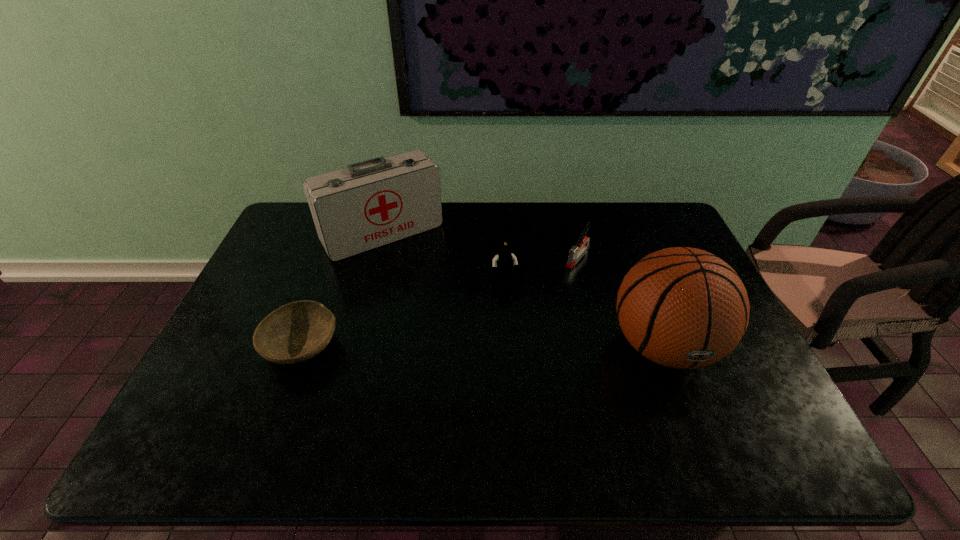
Locate an element on the screen. The image size is (960, 540). empty space between the first-aid kit and the basketball is located at coordinates (523, 289).

I want to click on free space between the stapler and the bowl, so click(441, 301).

Where is `vacant area that lies between the stapler and the first-aid kit`? Image resolution: width=960 pixels, height=540 pixels. vacant area that lies between the stapler and the first-aid kit is located at coordinates (481, 245).

Where is `vacant region between the fourth shortest object and the basketball`? Image resolution: width=960 pixels, height=540 pixels. vacant region between the fourth shortest object and the basketball is located at coordinates (523, 289).

I want to click on empty space that is in between the third tallest object and the basketball, so click(x=584, y=313).

The image size is (960, 540). In order to click on free point between the stapler and the bowl in this screenshot , I will do `click(441, 301)`.

Identify the location of unoccupied area between the bowl and the basketball. [x=483, y=346].

Image resolution: width=960 pixels, height=540 pixels. I want to click on free space between the basketball and the shortest object, so coord(483,346).

Select which object appears as the closest to the third shortest object. Please provide its 2D coordinates. Your answer should be formatted as a tuple, i.e. [(x, y)], where the tuple contains the x and y coordinates of a point satisfying the conditions above.

[(575, 252)]

Locate an element on the screen. object that stands as the second closest to the bowl is located at coordinates (503, 263).